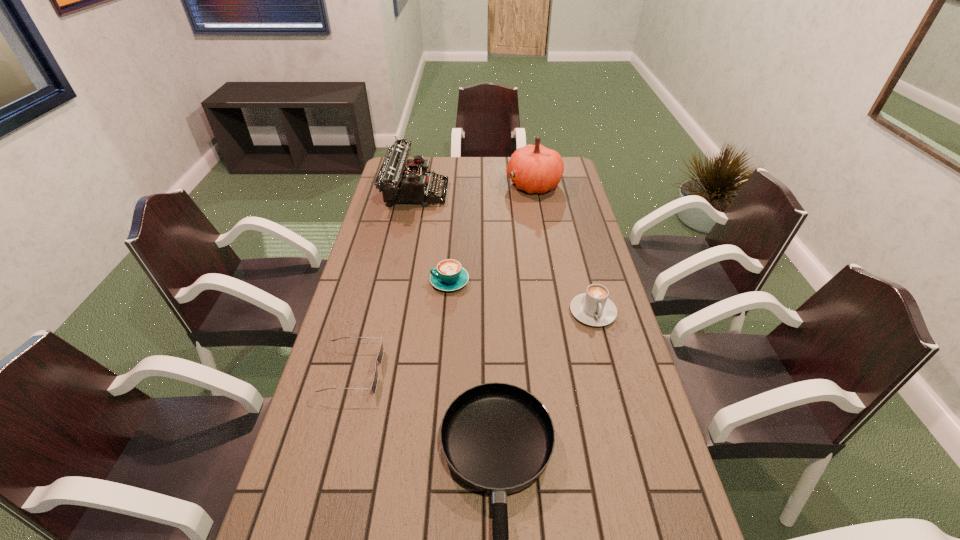
Identify the location of blank region between the farther cappuccino and the shortest object. (401, 326).

At what (x,y) coordinates should I click in order to perform the action: click on vacant point located between the shortest object and the typewriter. Please return your answer as a coordinate pair (x, y). The height and width of the screenshot is (540, 960). Looking at the image, I should click on (384, 282).

Identify the location of vacant space that is in between the typewriter and the shortest object. This screenshot has height=540, width=960. (384, 282).

At what (x,y) coordinates should I click in order to perform the action: click on free area in between the sunglasses and the third nearest object. Please return your answer as a coordinate pair (x, y). The height and width of the screenshot is (540, 960). Looking at the image, I should click on (472, 341).

The image size is (960, 540). In order to click on free space between the right cappuccino and the third farthest object in this screenshot , I will do `click(521, 296)`.

The height and width of the screenshot is (540, 960). Identify the location of the third closest object to the typewriter. (593, 308).

Choose which object is the second nearest neighbor to the left cappuccino. Please provide its 2D coordinates. Your answer should be formatted as a tuple, i.e. [(x, y)], where the tuple contains the x and y coordinates of a point satisfying the conditions above.

[(399, 183)]